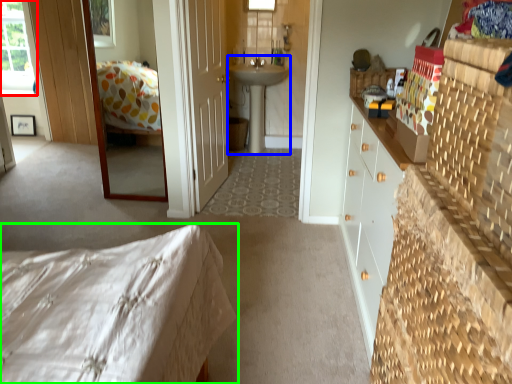
Question: Which is nearer to the window (highlighted by a red box)? sink (highlighted by a blue box) or bed (highlighted by a green box).

Choices:
 (A) sink
 (B) bed

Answer: (A)